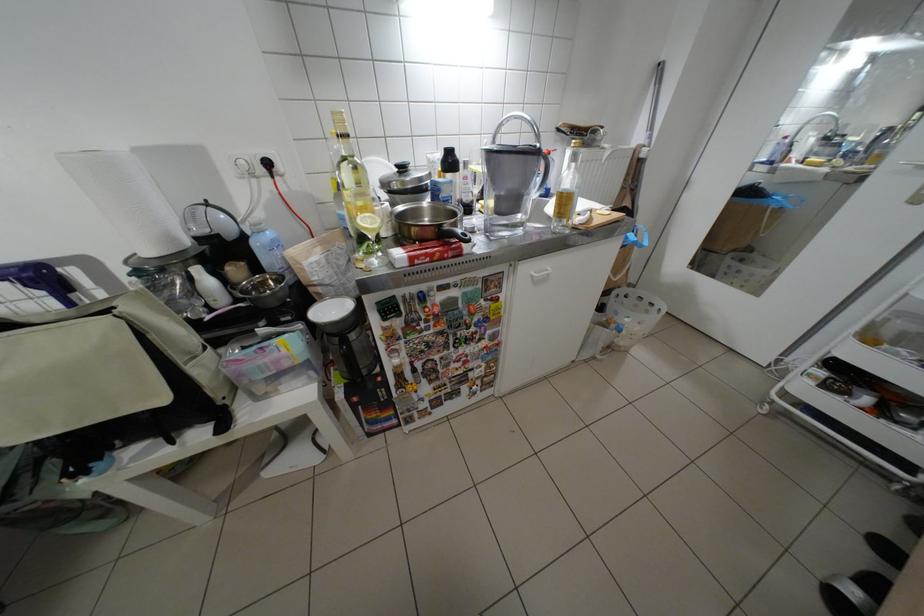
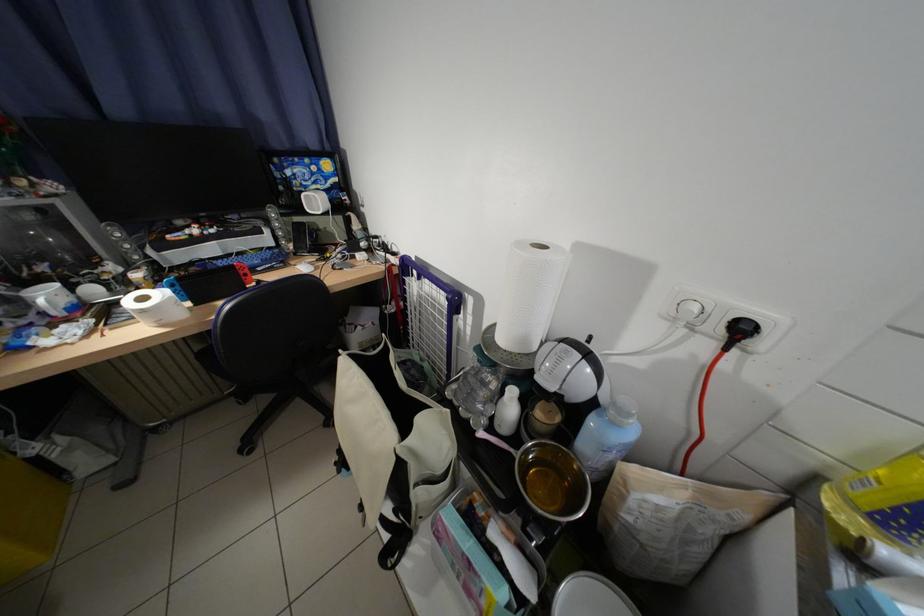
Where in the second image is the point corresponding to point (162, 254) from the first image?

(514, 341)